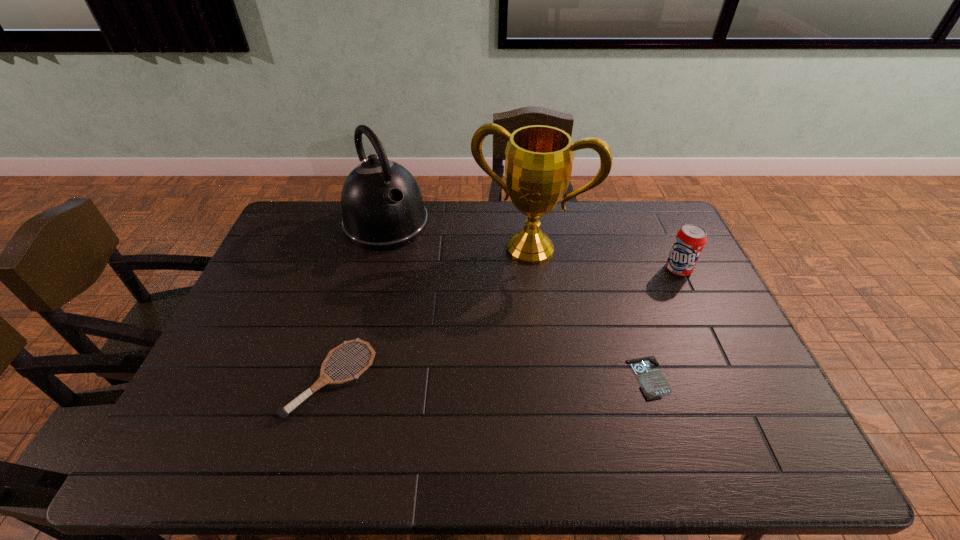
Locate an element on the screen. free space located 0.140m on the front-facing side of the award is located at coordinates (503, 298).

I want to click on free point located 0.280m on the front-facing side of the award, so click(x=490, y=332).

Identify the location of free space located on the surface of the third shortest object. click(x=643, y=288).

At what (x,y) coordinates should I click in order to perform the action: click on free region located on the surface of the third shortest object. Please return your answer as a coordinate pair (x, y). The height and width of the screenshot is (540, 960). Looking at the image, I should click on (638, 291).

The height and width of the screenshot is (540, 960). I want to click on vacant space located on the surface of the third shortest object, so click(x=631, y=294).

Identify the location of blank space located on the spout of the fourth shortest object. The image size is (960, 540). pyautogui.click(x=440, y=292).

You are a GUI agent. You are given a task and a screenshot of the screen. Output one action in this format:
    pyautogui.click(x=<x>, y=<y>)
    Task: Click on the vacant region located on the spout of the fourth shortest object
    The image size is (960, 540).
    Given the screenshot: What is the action you would take?
    pyautogui.click(x=428, y=277)

Where is `vacant space located on the spout of the fourth shortest object`? vacant space located on the spout of the fourth shortest object is located at coordinates (432, 282).

Where is `award that is positioned at the far edge`? The image size is (960, 540). award that is positioned at the far edge is located at coordinates point(538,166).

The image size is (960, 540). Find the location of `kettle located at the far edge`. kettle located at the far edge is located at coordinates (382, 206).